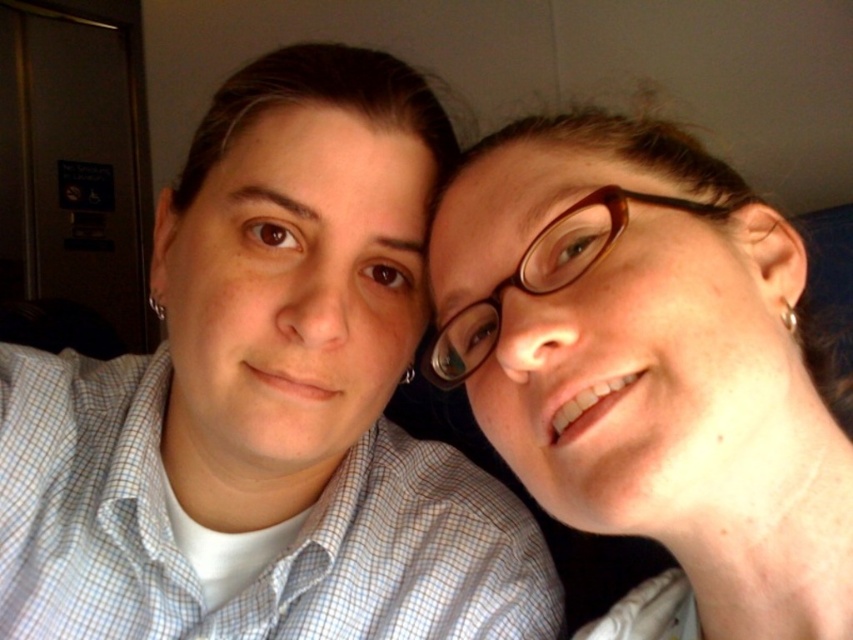
Can you confirm if brown glossy glasses at upper right is positioned above brown tortoiseshell glasses at center?

Actually, brown glossy glasses at upper right is below brown tortoiseshell glasses at center.

Who is more distant from viewer, (798, 572) or (450, 388)?

The point (450, 388) is behind.

Where is `brown glossy glasses at upper right`? This screenshot has width=853, height=640. brown glossy glasses at upper right is located at coordinates (650, 362).